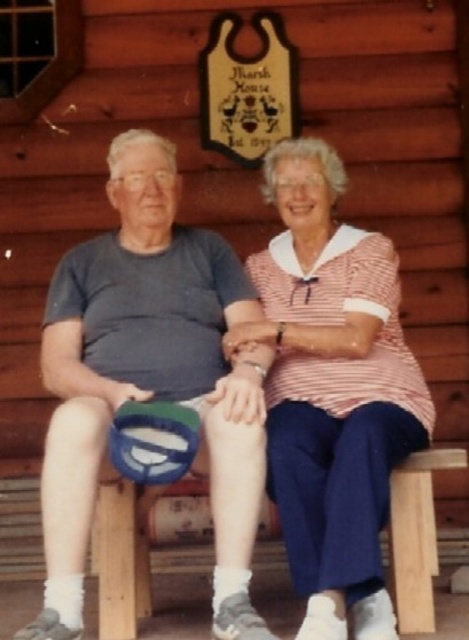
You are standing at point (392, 464) and want to walk to the cabin entrance. There is an obstacle at point (121, 164). Will you have to go around it?

Point (121, 164) is behind point (392, 464), so you will not encounter the obstacle on your path to the cabin entrance.